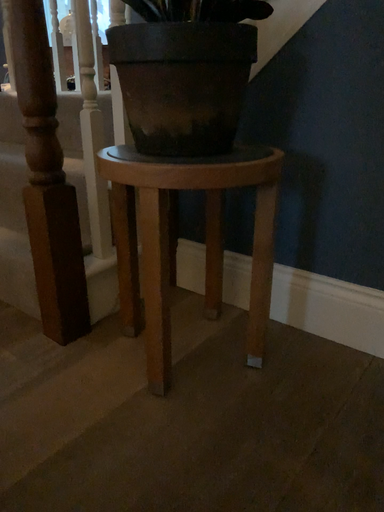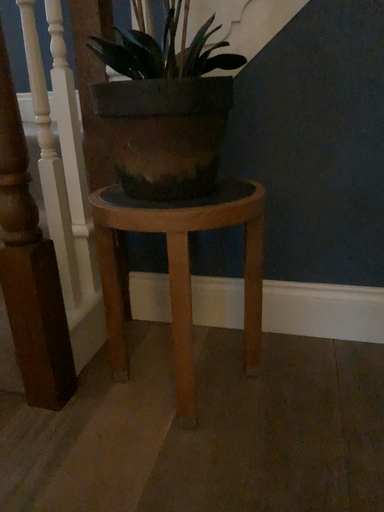
Question: How did the camera likely rotate when shooting the video?

Choices:
 (A) rotated right
 (B) rotated left

Answer: (A)